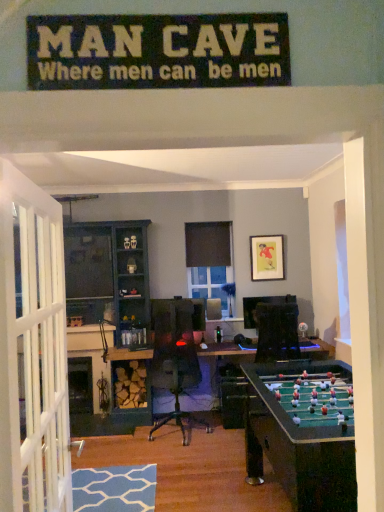
Question: Is matte black picture frame at upper center to the left or to the right of teal wood entertainment center at left in the image?

Choices:
 (A) left
 (B) right

Answer: (B)

Question: Is matte black picture frame at upper center taller or shorter than teal wood entertainment center at left?

Choices:
 (A) short
 (B) tall

Answer: (A)

Question: Is matte black picture frame at upper center situated inside teal wood entertainment center at left or outside?

Choices:
 (A) inside
 (B) outside

Answer: (B)

Question: Considering the positions of teal wood entertainment center at left and matte black picture frame at upper center in the image, is teal wood entertainment center at left taller or shorter than matte black picture frame at upper center?

Choices:
 (A) short
 (B) tall

Answer: (B)

Question: Looking at their shapes, would you say teal wood entertainment center at left is wider or thinner than matte black picture frame at upper center?

Choices:
 (A) wide
 (B) thin

Answer: (A)

Question: Is point (82, 321) closer or farther from the camera than point (283, 279)?

Choices:
 (A) closer
 (B) farther

Answer: (A)

Question: Considering the positions of teal wood entertainment center at left and matte black picture frame at upper center in the image, is teal wood entertainment center at left bigger or smaller than matte black picture frame at upper center?

Choices:
 (A) small
 (B) big

Answer: (B)